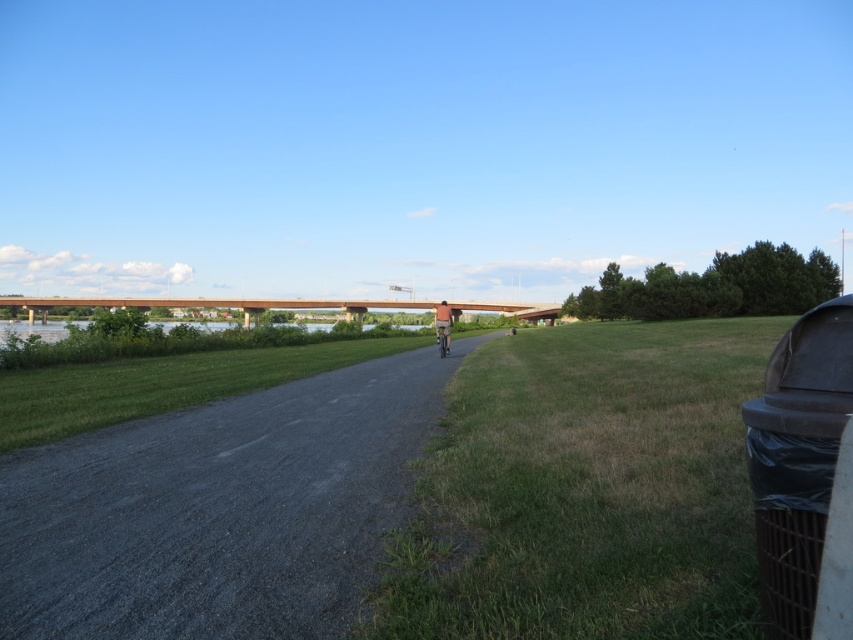
Question: Which is farther from the gray gravel path at center?

Choices:
 (A) denim jacket at center
 (B) metallic silver bicycle at center

Answer: (B)

Question: Does gray gravel path at center have a greater width compared to metallic silver bicycle at center?

Choices:
 (A) no
 (B) yes

Answer: (B)

Question: Estimate the real-world distances between objects in this image. Which object is closer to the denim jacket at center?

Choices:
 (A) metallic silver bicycle at center
 (B) green grass at center
 (C) gray gravel path at center

Answer: (A)

Question: Is gray gravel path at center above metallic silver bicycle at center?

Choices:
 (A) yes
 (B) no

Answer: (B)

Question: Which object is positioned closest to the denim jacket at center?

Choices:
 (A) gray gravel path at center
 (B) green grass at center
 (C) metallic silver bicycle at center

Answer: (C)

Question: Is green grass at center bigger than gray gravel path at center?

Choices:
 (A) yes
 (B) no

Answer: (A)